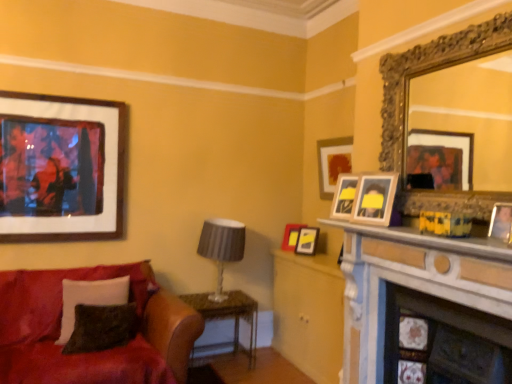
Question: Is matte gray lampshade at center next to wooden framed artwork at upper left, which ranks as the 3th picture frame in back-to-front order?

Choices:
 (A) yes
 (B) no

Answer: (B)

Question: Is matte gray lampshade at center at the right side of wooden framed artwork at upper left, positioned as the 3th picture frame in front-to-back order?

Choices:
 (A) yes
 (B) no

Answer: (A)

Question: Does matte gray lampshade at center appear on the left side of wooden framed artwork at upper left, the fifth picture frame when ordered from right to left?

Choices:
 (A) yes
 (B) no

Answer: (B)

Question: Does matte gray lampshade at center have a greater height compared to wooden framed artwork at upper left, which ranks as the 3th picture frame in back-to-front order?

Choices:
 (A) yes
 (B) no

Answer: (B)

Question: From the image's perspective, is matte gray lampshade at center on top of wooden framed artwork at upper left, the fifth picture frame when ordered from right to left?

Choices:
 (A) no
 (B) yes

Answer: (A)

Question: Is point (122, 332) closer or farther from the camera than point (204, 221)?

Choices:
 (A) farther
 (B) closer

Answer: (B)

Question: Considering the relative positions of velvet black pillow at lower left, the 2th pillow positioned from the back, and matte gray lampshade at center in the image provided, is velvet black pillow at lower left, the 2th pillow positioned from the back, to the left or to the right of matte gray lampshade at center?

Choices:
 (A) left
 (B) right

Answer: (A)

Question: Is velvet black pillow at lower left, the 2th pillow positioned from the back, inside or outside of matte gray lampshade at center?

Choices:
 (A) inside
 (B) outside

Answer: (B)

Question: From the image's perspective, relative to matte gray lampshade at center, is velvet black pillow at lower left, the first pillow from the front, above or below?

Choices:
 (A) above
 (B) below

Answer: (B)

Question: Is matte gray lampshade at center wider or thinner than matte wooden picture frame at upper right, placed as the 2th picture frame when sorted from back to front?

Choices:
 (A) thin
 (B) wide

Answer: (B)

Question: Considering the relative positions of matte gray lampshade at center and matte wooden picture frame at upper right, the 4th picture frame from the front, in the image provided, is matte gray lampshade at center to the left or to the right of matte wooden picture frame at upper right, the 4th picture frame from the front,?

Choices:
 (A) left
 (B) right

Answer: (A)

Question: Considering the positions of matte gray lampshade at center and matte wooden picture frame at upper right, the 4th picture frame from the front, in the image, is matte gray lampshade at center taller or shorter than matte wooden picture frame at upper right, the 4th picture frame from the front,?

Choices:
 (A) tall
 (B) short

Answer: (A)

Question: Is point (240, 254) closer or farther from the camera than point (321, 190)?

Choices:
 (A) farther
 (B) closer

Answer: (B)

Question: Is white marble fireplace at center, which is counted as the 1th fireplace, starting from the top, to the left or to the right of gold ornate mirror at upper right in the image?

Choices:
 (A) right
 (B) left

Answer: (B)

Question: Considering the positions of white marble fireplace at center, which is counted as the 1th fireplace, starting from the top, and gold ornate mirror at upper right in the image, is white marble fireplace at center, which is counted as the 1th fireplace, starting from the top, taller or shorter than gold ornate mirror at upper right?

Choices:
 (A) short
 (B) tall

Answer: (B)